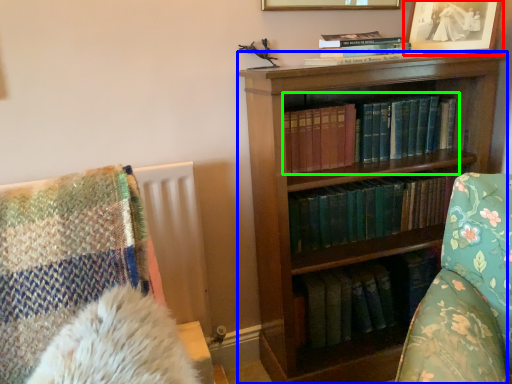
Question: Estimate the real-world distances between objects in this image. Which object is closer to picture frame (highlighted by a red box), bookcase (highlighted by a blue box) or book (highlighted by a green box)?

Choices:
 (A) bookcase
 (B) book

Answer: (B)